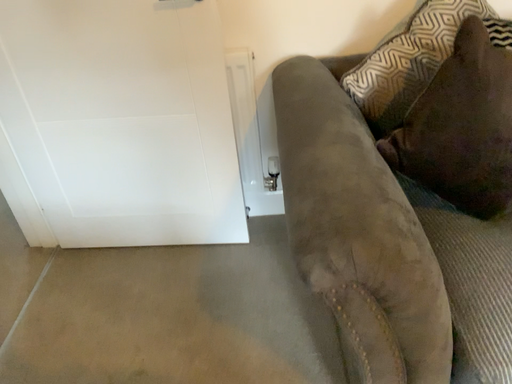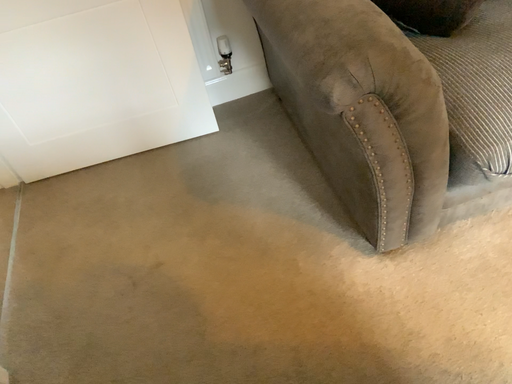
Question: Which way did the camera rotate in the video?

Choices:
 (A) rotated upward
 (B) rotated downward

Answer: (B)